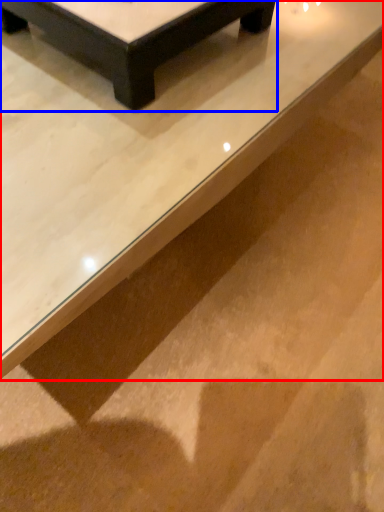
Question: Among these objects, which one is nearest to the camera, table (highlighted by a red box) or table (highlighted by a blue box)?

Choices:
 (A) table
 (B) table

Answer: (A)